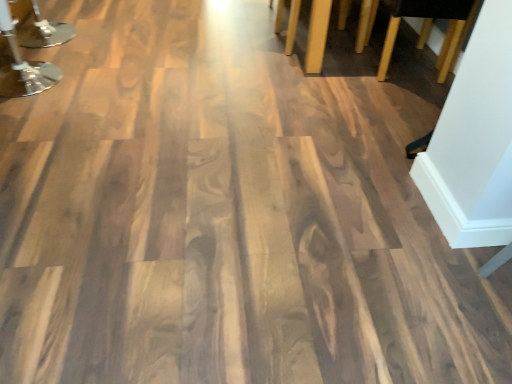
Question: From the image's perspective, relative to polished chrome table at upper left, arranged as the 2th furniture when viewed from the right, is wooden table legs at upper right, acting as the 2th furniture starting from the left, above or below?

Choices:
 (A) above
 (B) below

Answer: (A)

Question: Is point (359, 36) closer or farther from the camera than point (30, 77)?

Choices:
 (A) closer
 (B) farther

Answer: (B)

Question: Is wooden table legs at upper right, acting as the 2th furniture starting from the left, bigger or smaller than polished chrome table at upper left, marked as the 1th furniture in a left-to-right arrangement?

Choices:
 (A) small
 (B) big

Answer: (B)

Question: From a real-world perspective, is polished chrome table at upper left, arranged as the 2th furniture when viewed from the right, physically located above or below wooden table legs at upper right, acting as the 2th furniture starting from the left?

Choices:
 (A) below
 (B) above

Answer: (B)

Question: Is point coord(31,77) closer or farther from the camera than point coord(470,6)?

Choices:
 (A) closer
 (B) farther

Answer: (A)

Question: Based on their positions, is polished chrome table at upper left, marked as the 1th furniture in a left-to-right arrangement, located to the left or right of wooden table legs at upper right, acting as the 2th furniture starting from the left?

Choices:
 (A) left
 (B) right

Answer: (A)

Question: Considering their positions, is polished chrome table at upper left, marked as the 1th furniture in a left-to-right arrangement, located in front of or behind wooden table legs at upper right, the first furniture in the right-to-left sequence?

Choices:
 (A) behind
 (B) front

Answer: (B)